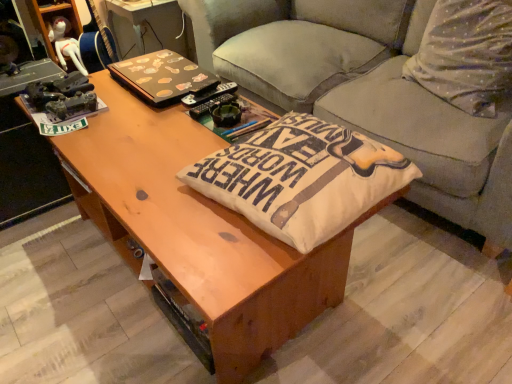
Question: From a real-world perspective, relative to brown matte laptop at upper center, is white cotton pillow at upper right, the first throw pillow viewed from the right, vertically above or below?

Choices:
 (A) below
 (B) above

Answer: (A)

Question: In terms of height, does white cotton pillow at upper right, the first throw pillow viewed from the right, look taller or shorter compared to brown matte laptop at upper center?

Choices:
 (A) tall
 (B) short

Answer: (A)

Question: Which object is the farthest from the gray fabric couch at center?

Choices:
 (A) brown matte laptop at upper center
 (B) white cotton pillow at upper right, acting as the first throw pillow starting from the back
 (C) beige fabric cushion at center, marked as the first throw pillow in a bottom-to-top arrangement

Answer: (C)

Question: Considering the real-world distances, which object is farthest from the gray fabric couch at center?

Choices:
 (A) white cotton pillow at upper right, the first throw pillow viewed from the right
 (B) brown matte laptop at upper center
 (C) beige fabric cushion at center, which is the 1th throw pillow from front to back

Answer: (C)